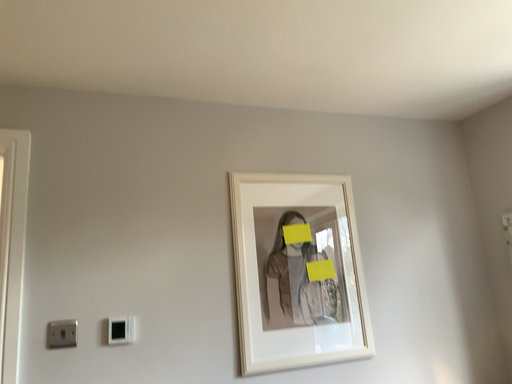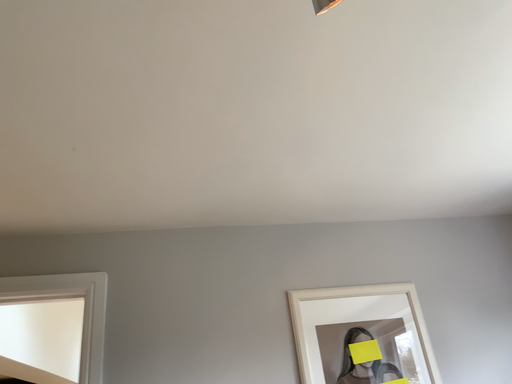
Question: Which way did the camera rotate in the video?

Choices:
 (A) rotated downward
 (B) rotated upward

Answer: (B)